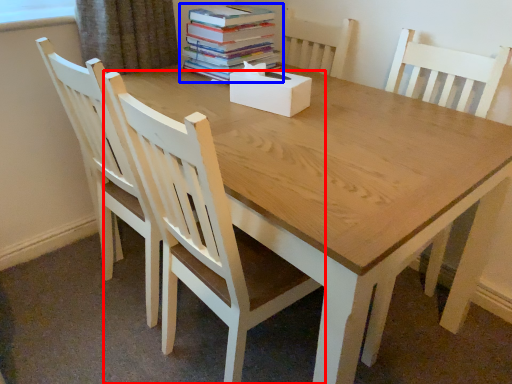
Question: Which object appears closest to the camera in this image, chair (highlighted by a red box) or book (highlighted by a blue box)?

Choices:
 (A) chair
 (B) book

Answer: (A)